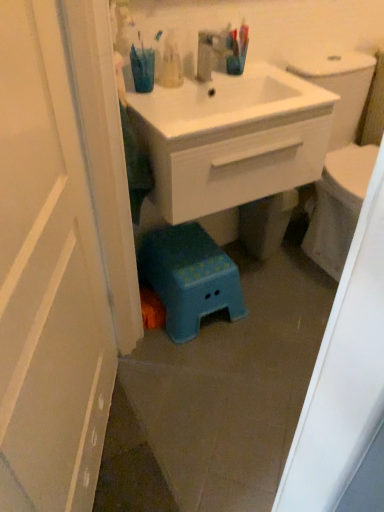
What are the coordinates of `spots to the right of blue plastic step stool at lower center` in the screenshot? It's located at (277, 310).